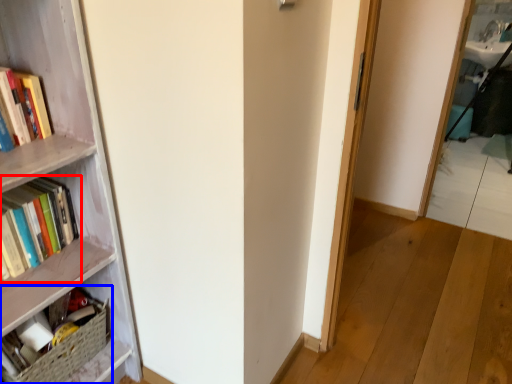
Question: Which object is further to the camera taking this photo, book (highlighted by a red box) or book (highlighted by a blue box)?

Choices:
 (A) book
 (B) book

Answer: (B)